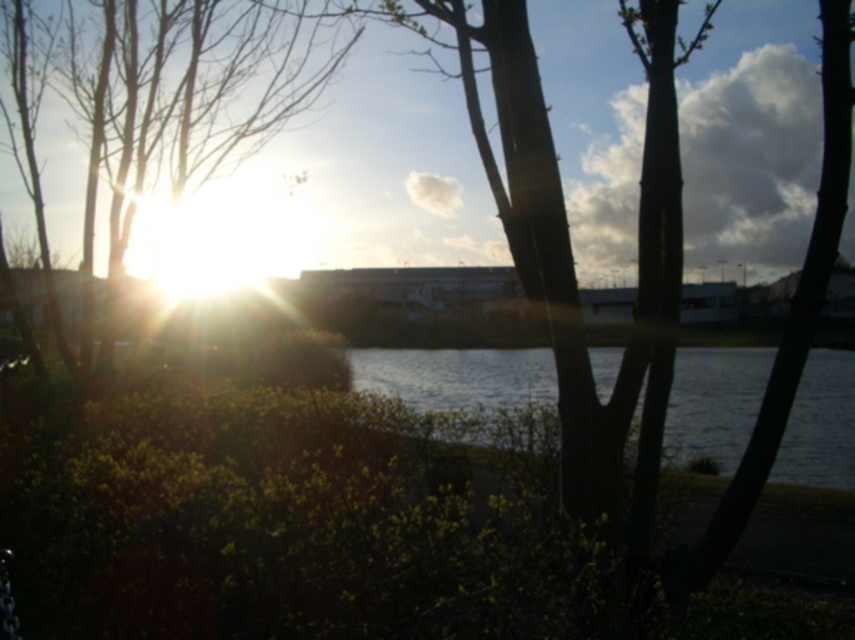
How much distance is there between bare branches at left and silvery reflective water at center?

bare branches at left is 40.28 feet from silvery reflective water at center.

Who is taller, bare branches at left or silvery reflective water at center?

bare branches at left is taller.

Between point (281, 45) and point (360, 365), which one is positioned in front?

Point (281, 45) is more forward.

The image size is (855, 640). I want to click on bare branches at left, so click(187, 96).